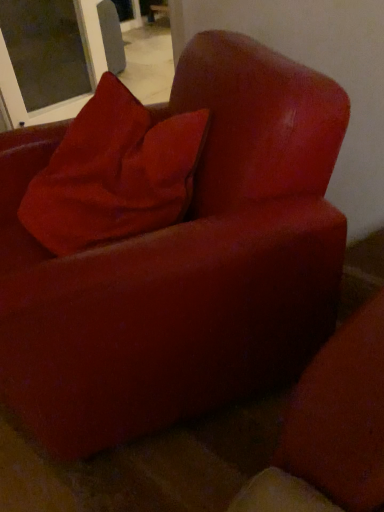
Question: Considering the relative sizes of transparent glass screen door at upper left and velvet red pillow at upper left in the image provided, is transparent glass screen door at upper left taller than velvet red pillow at upper left?

Choices:
 (A) yes
 (B) no

Answer: (A)

Question: From a real-world perspective, does transparent glass screen door at upper left stand above velvet red pillow at upper left?

Choices:
 (A) yes
 (B) no

Answer: (B)

Question: Is transparent glass screen door at upper left in front of velvet red pillow at upper left?

Choices:
 (A) no
 (B) yes

Answer: (A)

Question: Are transparent glass screen door at upper left and velvet red pillow at upper left making contact?

Choices:
 (A) no
 (B) yes

Answer: (A)

Question: Can you confirm if transparent glass screen door at upper left is bigger than velvet red pillow at upper left?

Choices:
 (A) no
 (B) yes

Answer: (B)

Question: Can you confirm if transparent glass screen door at upper left is wider than velvet red pillow at upper left?

Choices:
 (A) yes
 (B) no

Answer: (A)

Question: Does velvet red pillow at upper left appear on the right side of transparent glass screen door at upper left?

Choices:
 (A) yes
 (B) no

Answer: (A)

Question: Can you confirm if velvet red pillow at upper left is positioned to the left of transparent glass screen door at upper left?

Choices:
 (A) yes
 (B) no

Answer: (B)

Question: Can you confirm if velvet red pillow at upper left is thinner than transparent glass screen door at upper left?

Choices:
 (A) yes
 (B) no

Answer: (A)

Question: From the image's perspective, does velvet red pillow at upper left appear lower than transparent glass screen door at upper left?

Choices:
 (A) yes
 (B) no

Answer: (A)

Question: From the image's perspective, is velvet red pillow at upper left above transparent glass screen door at upper left?

Choices:
 (A) yes
 (B) no

Answer: (B)

Question: Is velvet red pillow at upper left far away from transparent glass screen door at upper left?

Choices:
 (A) yes
 (B) no

Answer: (A)

Question: From the image's perspective, is velvet red pillow at upper left positioned above or below transparent glass screen door at upper left?

Choices:
 (A) above
 (B) below

Answer: (B)